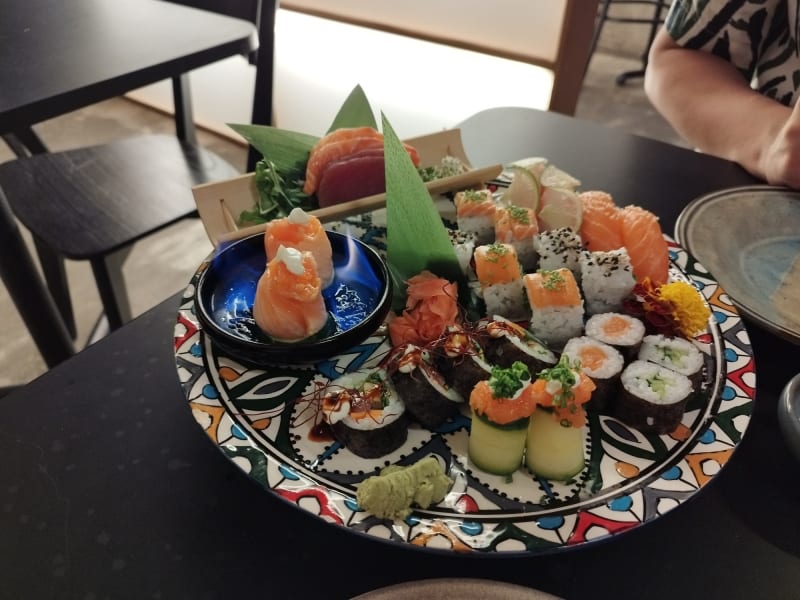
Where is `tan tray`? The image size is (800, 600). tan tray is located at coordinates (437, 144).